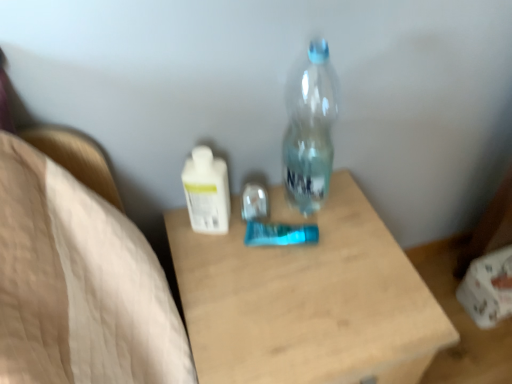
At what (x,y) coordinates should I click in order to perform the action: click on free location in front of transparent plastic bottle at center, which appears as the first bottle when viewed from the right. Please return your answer as a coordinate pair (x, y). This screenshot has height=384, width=512. Looking at the image, I should click on (315, 276).